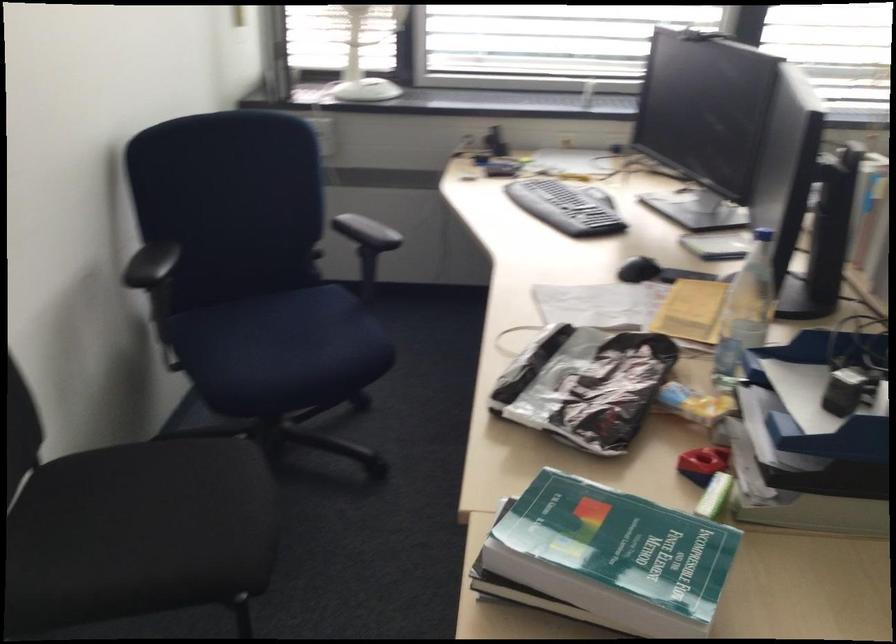
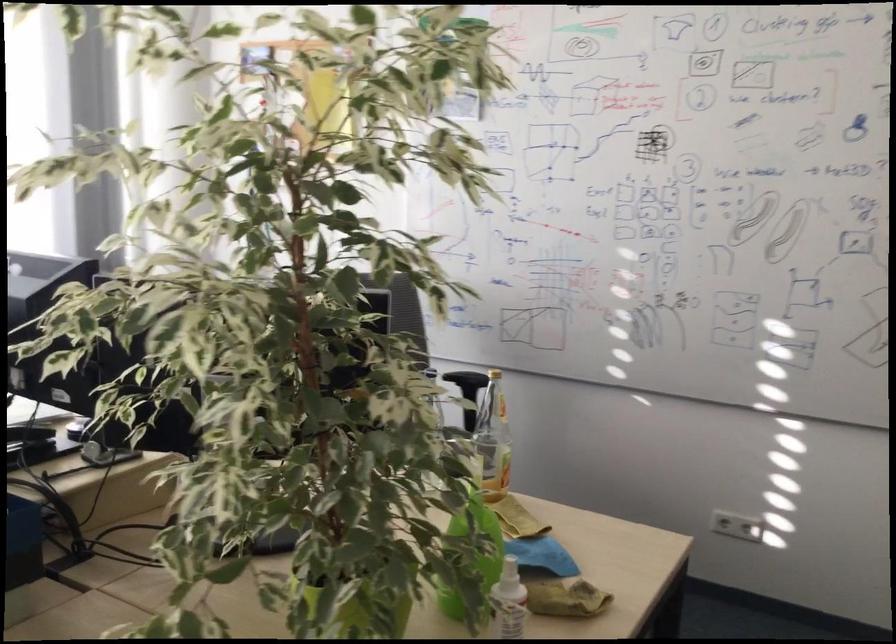
Question: The first image is from the beginning of the video and the second image is from the end. How did the camera likely rotate when shooting the video?

Choices:
 (A) Left
 (B) Right
 (C) Up
 (D) Down

Answer: (B)